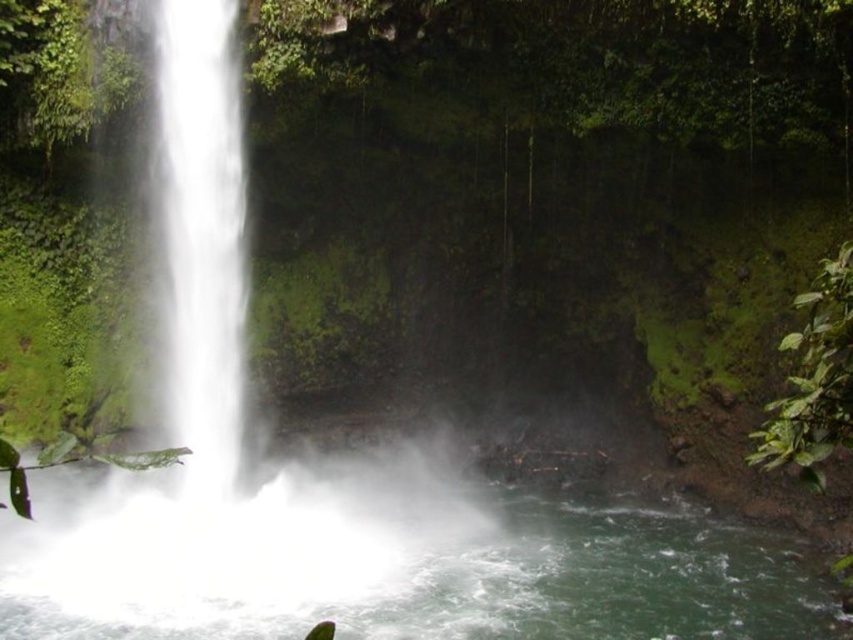
From the picture: Who is higher up, white frothy water at center or white misty waterfall at left?

white misty waterfall at left

Is white frothy water at center above white misty waterfall at left?

No.

Locate an element on the screen. The height and width of the screenshot is (640, 853). white frothy water at center is located at coordinates (399, 570).